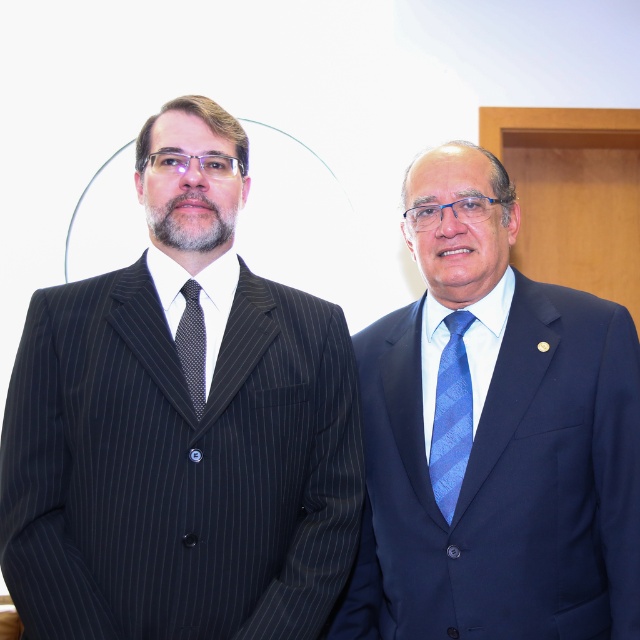
Question: Which of the following is the closest to the observer?

Choices:
 (A) pinstriped suit at left
 (B) black dotted fabric tie at left
 (C) blue textured tie at right

Answer: (A)

Question: Does blue textured tie at right appear under black dotted fabric tie at left?

Choices:
 (A) yes
 (B) no

Answer: (A)

Question: Is pinstriped suit at left positioned in front of blue textured tie at right?

Choices:
 (A) no
 (B) yes

Answer: (B)

Question: Which object is the closest to the blue textured tie at right?

Choices:
 (A) blue satin suit at right
 (B) pinstriped suit at left

Answer: (A)

Question: Among these points, which one is nearest to the camera?

Choices:
 (A) (120, 468)
 (B) (179, 324)
 (C) (552, 422)

Answer: (A)

Question: Is pinstriped suit at left to the left of black dotted fabric tie at left from the viewer's perspective?

Choices:
 (A) no
 (B) yes

Answer: (A)